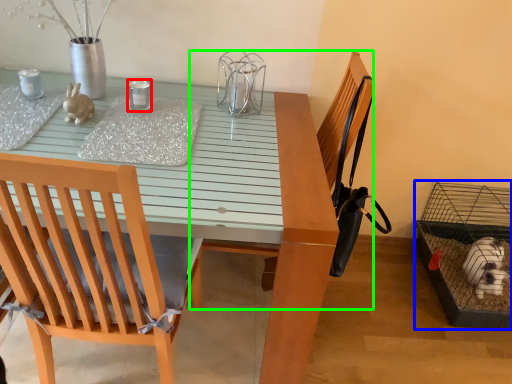
Question: Based on their relative distances, which object is nearer to candle holder (highlighted by a red box)? Choose from bird cage (highlighted by a blue box) and armchair (highlighted by a green box).

Choices:
 (A) bird cage
 (B) armchair

Answer: (B)